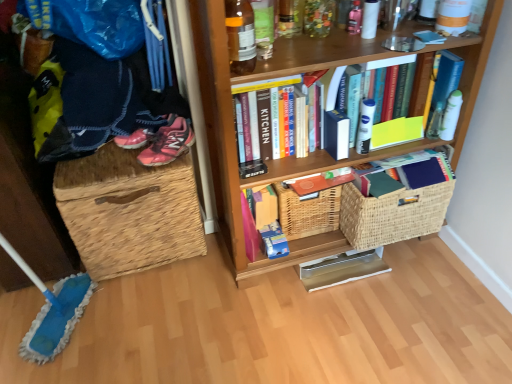
Identify the location of free location in front of metallic gold book at lower center, the first book from the bottom. (359, 322).